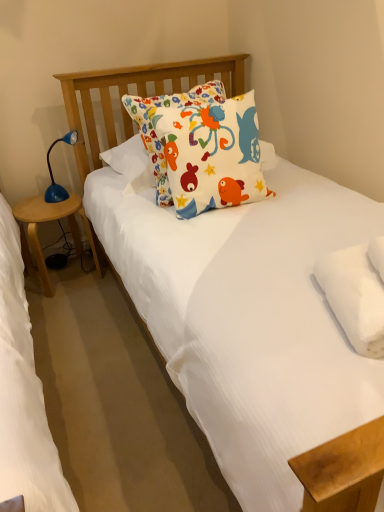
In order to click on white fluffy pillow at upper right, acting as the second pillow starting from the top in this screenshot , I will do `click(355, 297)`.

Locate an element on the screen. The width and height of the screenshot is (384, 512). wooden side table at left is located at coordinates (37, 231).

What do you see at coordinates (52, 173) in the screenshot? The width and height of the screenshot is (384, 512). I see `blue plastic table lamp at left` at bounding box center [52, 173].

Identify the location of white cotton pillow with colorful fish designs at center, positioned as the second pillow in right-to-left order. The image size is (384, 512). (201, 146).

Can wooden side table at left be found inside blue plastic table lamp at left?

No, wooden side table at left is not a part of blue plastic table lamp at left.

Is point (49, 169) more distant than point (48, 275)?

No, it is in front of (48, 275).

Is blue plastic table lamp at left not near wooden side table at left?

blue plastic table lamp at left is near wooden side table at left, not far away.

From the image's perspective, who appears lower, blue plastic table lamp at left or wooden side table at left?

wooden side table at left appears lower in the image.

Between blue plastic table lamp at left and white cotton pillow with colorful fish designs at center, positioned as the second pillow in front-to-back order, which one is positioned in front?

white cotton pillow with colorful fish designs at center, positioned as the second pillow in front-to-back order, is closer to the camera.

Identify the location of the 1st pillow below the blue plastic table lamp at left (from the image's perspective). This screenshot has height=512, width=384. (201, 146).

Which of these two, blue plastic table lamp at left or white cotton pillow with colorful fish designs at center, positioned as the second pillow in front-to-back order, is bigger?

white cotton pillow with colorful fish designs at center, positioned as the second pillow in front-to-back order.

Between point (41, 250) and point (46, 190), which one is positioned in front?

The point (46, 190) is closer to the camera.

Could you tell me if wooden side table at left is turned towards blue plastic table lamp at left?

No, wooden side table at left is not aimed at blue plastic table lamp at left.

From the image's perspective, would you say wooden side table at left is positioned over blue plastic table lamp at left?

No, from the image's perspective, wooden side table at left is not over blue plastic table lamp at left.

Is wooden side table at left taller or shorter than blue plastic table lamp at left?

In the image, wooden side table at left appears to be taller than blue plastic table lamp at left.

In the scene shown: Is white cotton pillow with colorful fish designs at center, acting as the 2th pillow starting from the bottom, aimed at wooden side table at left?

No, white cotton pillow with colorful fish designs at center, acting as the 2th pillow starting from the bottom, is not facing towards wooden side table at left.

Does white cotton pillow with colorful fish designs at center, positioned as the second pillow in right-to-left order, have a larger size compared to wooden side table at left?

Indeed, white cotton pillow with colorful fish designs at center, positioned as the second pillow in right-to-left order, has a larger size compared to wooden side table at left.

Which object is more forward, white cotton pillow with colorful fish designs at center, the first pillow from the left, or wooden side table at left?

white cotton pillow with colorful fish designs at center, the first pillow from the left, is more forward.

Can you confirm if white cotton pillow with colorful fish designs at center, the first pillow from the left, is thinner than wooden side table at left?

Indeed, white cotton pillow with colorful fish designs at center, the first pillow from the left, has a lesser width compared to wooden side table at left.

Which of these two, white cotton pillow with colorful fish designs at center, acting as the 2th pillow starting from the bottom, or white fluffy pillow at upper right, the 1th pillow ordered from the bottom, stands taller?

white cotton pillow with colorful fish designs at center, acting as the 2th pillow starting from the bottom.

Is white cotton pillow with colorful fish designs at center, placed as the first pillow when sorted from top to bottom, directly adjacent to white fluffy pillow at upper right, which is the first pillow from front to back?

No, white cotton pillow with colorful fish designs at center, placed as the first pillow when sorted from top to bottom, is not making contact with white fluffy pillow at upper right, which is the first pillow from front to back.

Consider the image. How distant is white cotton pillow with colorful fish designs at center, positioned as the second pillow in front-to-back order, from white fluffy pillow at upper right, acting as the second pillow starting from the top?

The distance of white cotton pillow with colorful fish designs at center, positioned as the second pillow in front-to-back order, from white fluffy pillow at upper right, acting as the second pillow starting from the top, is 75.72 centimeters.

Based on the photo, is white cotton pillow with colorful fish designs at center, positioned as the second pillow in front-to-back order, aimed at white fluffy pillow at upper right, the second pillow when ordered from back to front?

Yes, white cotton pillow with colorful fish designs at center, positioned as the second pillow in front-to-back order, faces towards white fluffy pillow at upper right, the second pillow when ordered from back to front.

Does point (341, 286) come closer to viewer compared to point (43, 201)?

Yes, point (341, 286) is closer to viewer.

Can you confirm if white fluffy pillow at upper right, the 1th pillow ordered from the bottom, is thinner than wooden side table at left?

Yes.

Is white fluffy pillow at upper right, the 2th pillow from the left, oriented towards wooden side table at left?

No, white fluffy pillow at upper right, the 2th pillow from the left, is not facing towards wooden side table at left.

From the image's perspective, is white fluffy pillow at upper right, acting as the second pillow starting from the top, located beneath wooden side table at left?

Yes, from the image's perspective, white fluffy pillow at upper right, acting as the second pillow starting from the top, is beneath wooden side table at left.

What's the angular difference between wooden side table at left and white cotton pillow with colorful fish designs at center, placed as the 1th pillow when sorted from back to front,'s facing directions?

17.5 degrees separate the facing orientations of wooden side table at left and white cotton pillow with colorful fish designs at center, placed as the 1th pillow when sorted from back to front.

Is point (47, 281) positioned after point (192, 91)?

Yes, point (47, 281) is farther from viewer.

Starting from the wooden side table at left, which pillow is the 1st one to the right? Please provide its 2D coordinates.

[(201, 146)]

In the scene shown: Is wooden side table at left positioned beyond the bounds of white cotton pillow with colorful fish designs at center, positioned as the second pillow in front-to-back order?

Yes, wooden side table at left is located beyond the bounds of white cotton pillow with colorful fish designs at center, positioned as the second pillow in front-to-back order.

Find the location of a particular element. The image size is (384, 512). table lamp located above the wooden side table at left (from the image's perspective) is located at coordinates (52, 173).

Locate an element on the screen. The image size is (384, 512). table lamp that appears behind the white cotton pillow with colorful fish designs at center, positioned as the second pillow in right-to-left order is located at coordinates (52, 173).

From the image, which object appears to be farther from white cotton pillow with colorful fish designs at center, placed as the 1th pillow when sorted from back to front, blue plastic table lamp at left or white fluffy pillow at upper right, acting as the first pillow starting from the right?

Among the two, blue plastic table lamp at left is located further to white cotton pillow with colorful fish designs at center, placed as the 1th pillow when sorted from back to front.

Estimate the real-world distances between objects in this image. Which object is further from white cotton pillow with colorful fish designs at center, placed as the 1th pillow when sorted from back to front, wooden side table at left or white fluffy pillow at upper right, which is the first pillow from front to back?

Among the two, wooden side table at left is located further to white cotton pillow with colorful fish designs at center, placed as the 1th pillow when sorted from back to front.

From the image, which object appears to be farther from wooden side table at left, blue plastic table lamp at left or white fluffy pillow at upper right, the second pillow when ordered from back to front?

The object further to wooden side table at left is white fluffy pillow at upper right, the second pillow when ordered from back to front.

When comparing their distances from blue plastic table lamp at left, does wooden side table at left or white cotton pillow with colorful fish designs at center, positioned as the second pillow in right-to-left order, seem closer?

wooden side table at left.

When comparing their distances from white fluffy pillow at upper right, acting as the first pillow starting from the right, does wooden side table at left or white cotton pillow with colorful fish designs at center, placed as the 1th pillow when sorted from back to front, seem closer?

white cotton pillow with colorful fish designs at center, placed as the 1th pillow when sorted from back to front.

Which object lies nearer to the anchor point white cotton pillow with colorful fish designs at center, placed as the 1th pillow when sorted from back to front, blue plastic table lamp at left or wooden side table at left?

The object closer to white cotton pillow with colorful fish designs at center, placed as the 1th pillow when sorted from back to front, is blue plastic table lamp at left.

From the image, which object appears to be nearer to blue plastic table lamp at left, white fluffy pillow at upper right, acting as the second pillow starting from the top, or wooden side table at left?

wooden side table at left lies closer to blue plastic table lamp at left than the other object.

When comparing their distances from blue plastic table lamp at left, does white fluffy pillow at upper right, acting as the first pillow starting from the right, or white cotton pillow with colorful fish designs at center, acting as the 2th pillow starting from the bottom, seem closer?

white cotton pillow with colorful fish designs at center, acting as the 2th pillow starting from the bottom, is closer to blue plastic table lamp at left.

Identify the location of table lamp situated between wooden side table at left and white cotton pillow with colorful fish designs at center, positioned as the second pillow in right-to-left order, from left to right. This screenshot has width=384, height=512. (52, 173).

Find the location of a particular element. The image size is (384, 512). pillow located between wooden side table at left and white fluffy pillow at upper right, acting as the second pillow starting from the top, in the left-right direction is located at coordinates (201, 146).

You are a GUI agent. You are given a task and a screenshot of the screen. Output one action in this format:
    pyautogui.click(x=<x>, y=<y>)
    Task: Click on the table located between white fluffy pillow at upper right, acting as the first pillow starting from the right, and blue plastic table lamp at left in the depth direction
    This screenshot has height=512, width=384.
    Given the screenshot: What is the action you would take?
    pyautogui.click(x=37, y=231)

Where is `pillow located between white fluffy pillow at upper right, the second pillow when ordered from back to front, and blue plastic table lamp at left in the depth direction`? The height and width of the screenshot is (512, 384). pillow located between white fluffy pillow at upper right, the second pillow when ordered from back to front, and blue plastic table lamp at left in the depth direction is located at coordinates (201, 146).